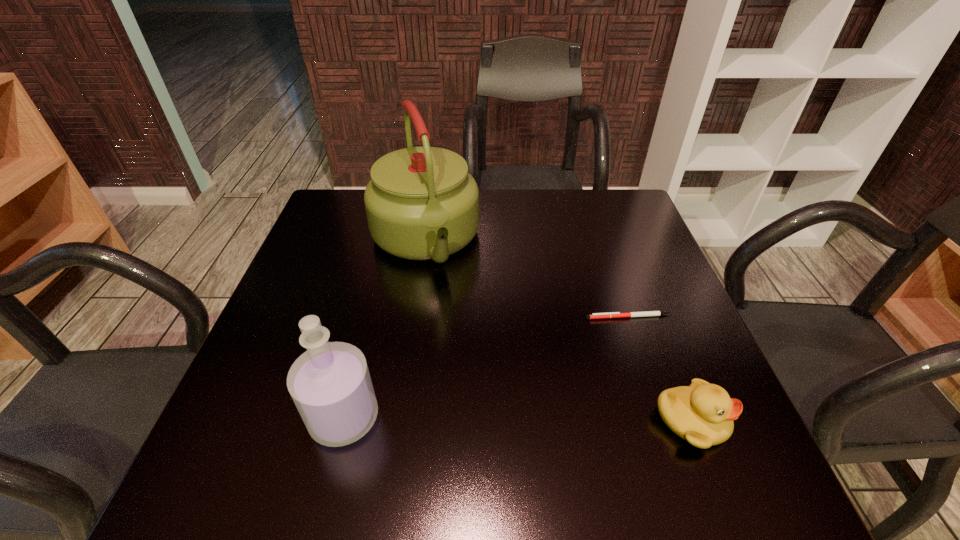
Locate an element on the screen. The image size is (960, 540). free space on the desktop that is between the perfume and the second shortest object and is positioned at the spout of the tallest object is located at coordinates point(492,419).

Where is `free space on the desktop that is between the perfume and the second shortest object and is positioned on the clicker of the third nearest object`? The height and width of the screenshot is (540, 960). free space on the desktop that is between the perfume and the second shortest object and is positioned on the clicker of the third nearest object is located at coordinates (467, 418).